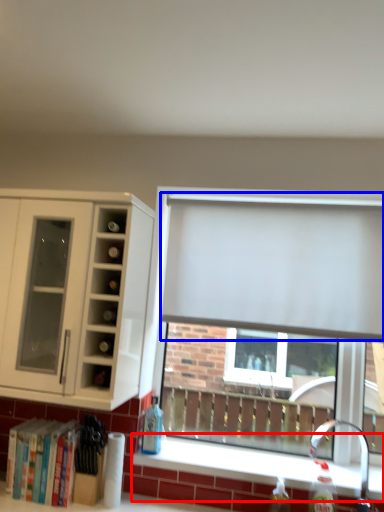
Question: Which object appears closest to the camera in this image, window sill (highlighted by a red box) or curtain (highlighted by a blue box)?

Choices:
 (A) window sill
 (B) curtain

Answer: (A)